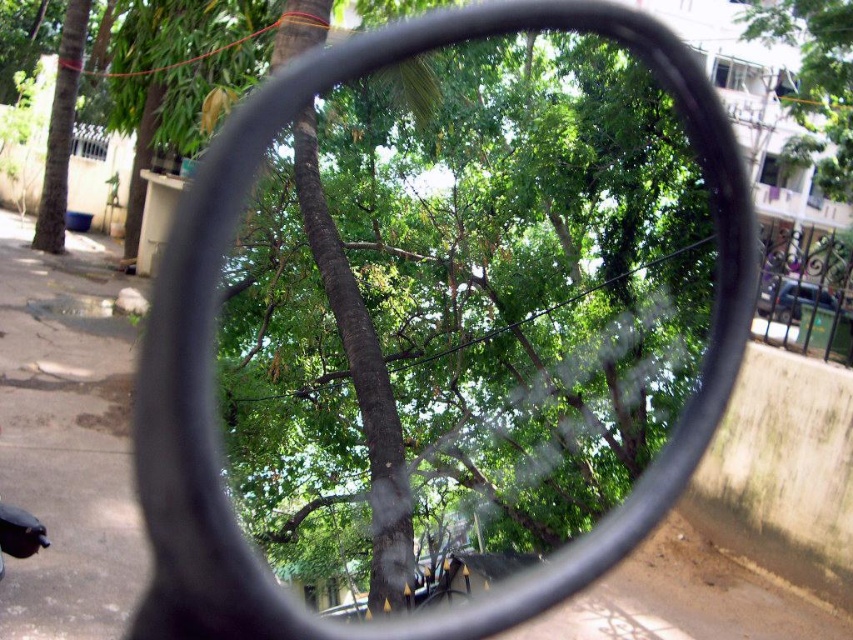
Question: Can you confirm if black rubber mirror at center is smaller than green leafy tree at left?

Choices:
 (A) yes
 (B) no

Answer: (B)

Question: Which point is farther from the camera taking this photo?

Choices:
 (A) (811, 147)
 (B) (61, 102)

Answer: (B)

Question: Which point is closer to the camera?

Choices:
 (A) (758, 4)
 (B) (178, 371)
 (C) (78, 19)

Answer: (B)

Question: Which object is the closest to the green leafy tree at left?

Choices:
 (A) black rubber mirror at center
 (B) green leafy tree at upper right

Answer: (A)

Question: Is green leafy tree at upper right to the left of green leafy tree at left from the viewer's perspective?

Choices:
 (A) no
 (B) yes

Answer: (A)

Question: Where is green leafy tree at upper right located in relation to green leafy tree at left in the image?

Choices:
 (A) above
 (B) below

Answer: (A)